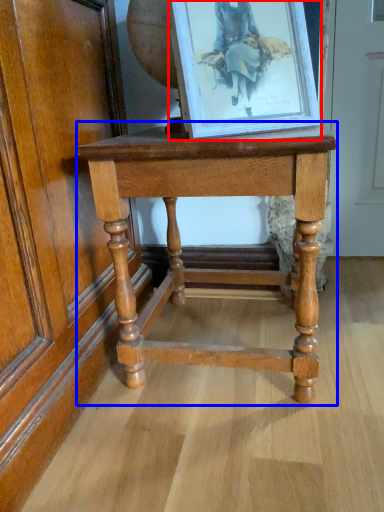
Question: Which point is closer to the camera, picture frame (highlighted by a red box) or table (highlighted by a blue box)?

Choices:
 (A) picture frame
 (B) table

Answer: (A)